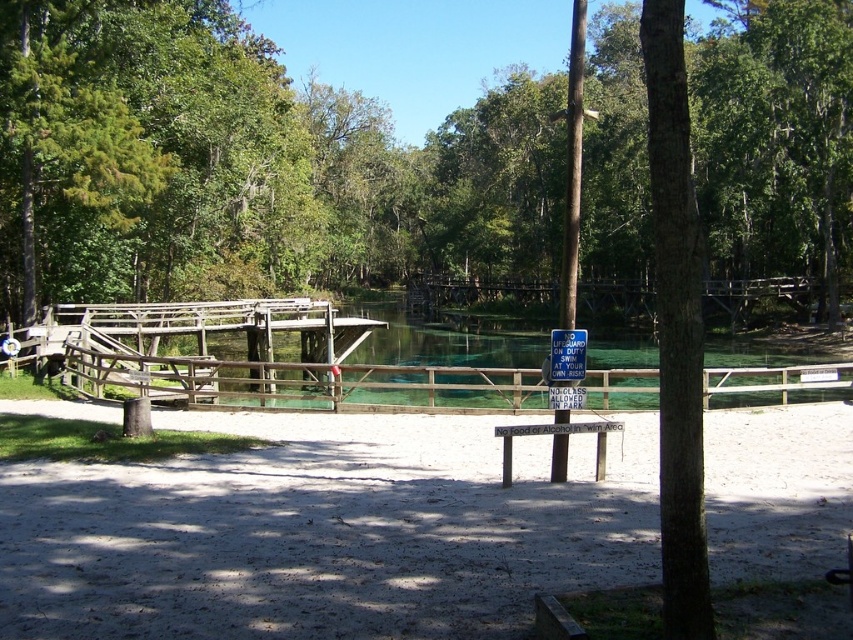
Does green leafy tree at center appear over white sandy ground at center?

Correct, green leafy tree at center is located above white sandy ground at center.

In the scene shown: Between green leafy tree at center and white sandy ground at center, which one has less height?

Standing shorter between the two is white sandy ground at center.

This screenshot has height=640, width=853. Describe the element at coordinates (242, 164) in the screenshot. I see `green leafy tree at center` at that location.

This screenshot has width=853, height=640. Identify the location of green leafy tree at center. (242, 164).

Can you confirm if green leafy tree at center is thinner than brown wooden fence at center?

No.

What do you see at coordinates (242, 164) in the screenshot? I see `green leafy tree at center` at bounding box center [242, 164].

Locate an element on the screen. Image resolution: width=853 pixels, height=640 pixels. green leafy tree at center is located at coordinates (242, 164).

Who is positioned more to the left, white sandy ground at center or brown wooden fence at center?

Positioned to the left is white sandy ground at center.

Who is lower down, white sandy ground at center or brown wooden fence at center?

white sandy ground at center is below.

This screenshot has width=853, height=640. What do you see at coordinates (322, 532) in the screenshot?
I see `white sandy ground at center` at bounding box center [322, 532].

The width and height of the screenshot is (853, 640). In order to click on white sandy ground at center in this screenshot , I will do [322, 532].